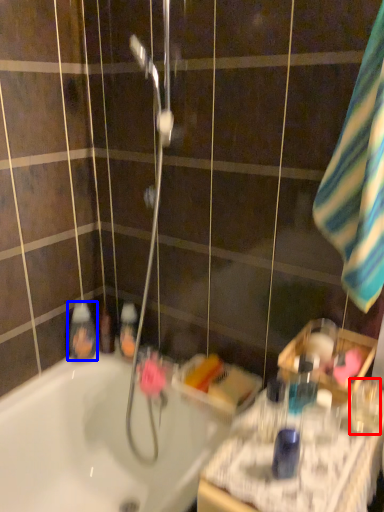
Question: Which point is further to the camera, mouthwash (highlighted by a red box) or mouthwash (highlighted by a blue box)?

Choices:
 (A) mouthwash
 (B) mouthwash

Answer: (B)